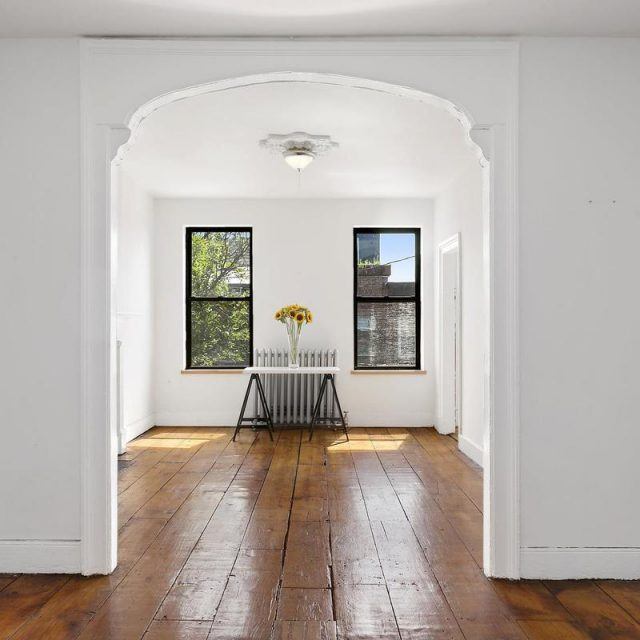
At what (x,y) coordinates should I click in order to perform the action: click on brick ledge. Please return your answer as a coordinate pair (x, y). This screenshot has height=640, width=640. Looking at the image, I should click on (369, 268), (400, 290).